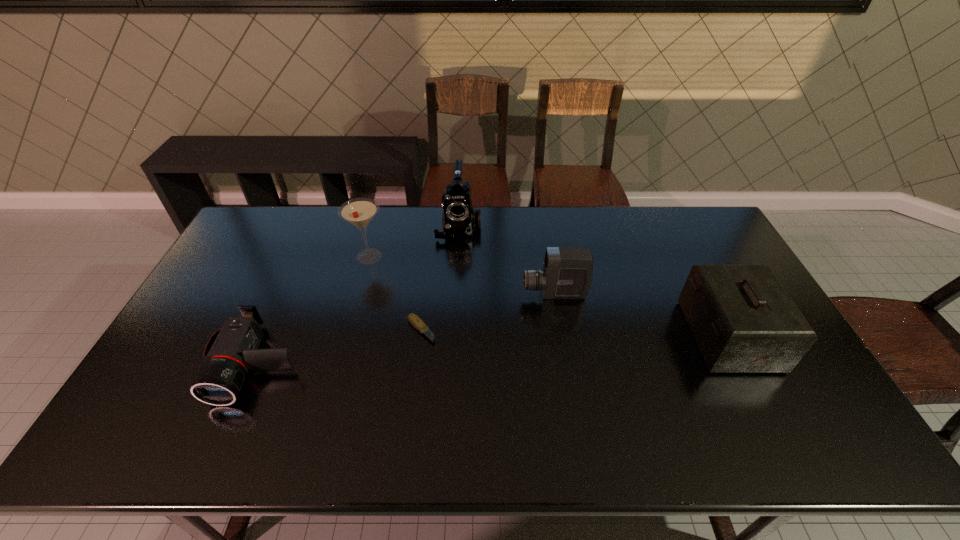
This screenshot has width=960, height=540. What are the coordinates of `free space located on the lens mount of the tallest camcorder` in the screenshot? It's located at (455, 287).

Where is `free point located on the right of the second object from left to right`? The width and height of the screenshot is (960, 540). free point located on the right of the second object from left to right is located at coordinates (441, 256).

Identify the location of vacant area situated 0.230m on the back of the rightmost object. The height and width of the screenshot is (540, 960). (685, 253).

In order to click on vacant region located at the front of the second shortest camcorder, highlighting the lens in this screenshot , I will do `click(420, 294)`.

This screenshot has width=960, height=540. I want to click on free space located 0.230m at the front of the second shortest camcorder, highlighting the lens, so click(449, 294).

This screenshot has width=960, height=540. Identify the location of free space located at the front of the second shortest camcorder, highlighting the lens. (481, 294).

Find the location of a particular element. vacant position located 0.110m on the lens of the shortest camcorder is located at coordinates (220, 450).

Where is `vacant region located 0.120m on the back of the pocketknife`? Image resolution: width=960 pixels, height=540 pixels. vacant region located 0.120m on the back of the pocketknife is located at coordinates (426, 288).

What are the coordinates of `camcorder present at the far edge` in the screenshot? It's located at (459, 218).

Locate an element on the screen. This screenshot has height=540, width=960. martini that is positioned at the far edge is located at coordinates (359, 212).